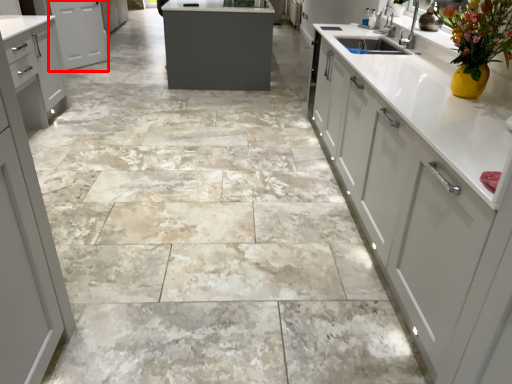
Question: From the image's perspective, where is cabinetry (annotated by the red box) located in relation to cabinetry in the image?

Choices:
 (A) above
 (B) below

Answer: (A)